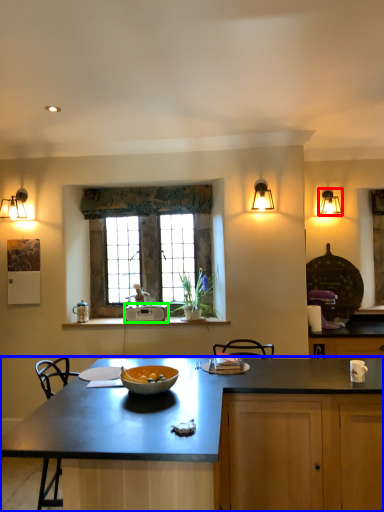
Question: Which object is the farthest from lamp (highlighted by a red box)? Choose among these: countertop (highlighted by a blue box) or appliance (highlighted by a green box).

Choices:
 (A) countertop
 (B) appliance

Answer: (A)